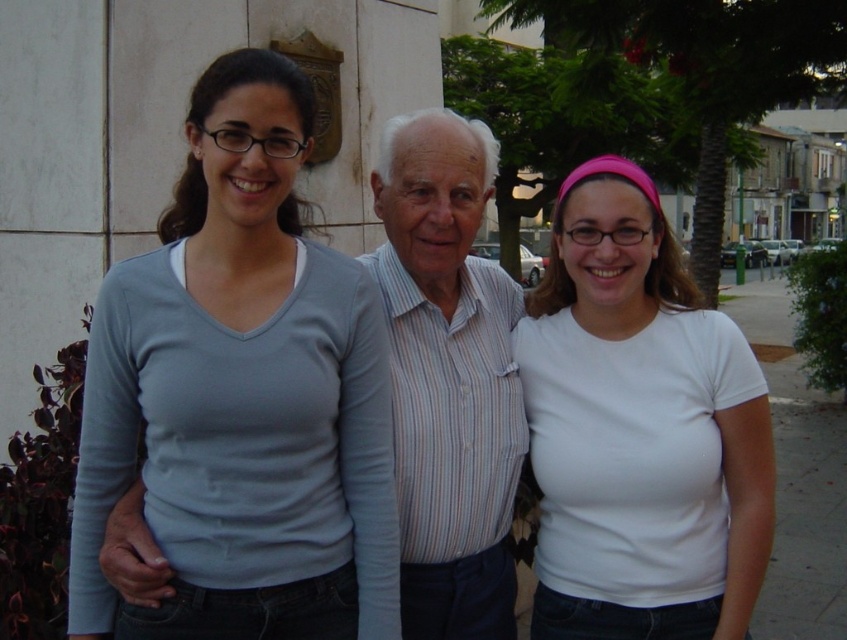
Who is positioned more to the left, white matte t-shirt at center or striped cotton shirt at center?

From the viewer's perspective, striped cotton shirt at center appears more on the left side.

From the picture: Between white matte t-shirt at center and striped cotton shirt at center, which one has more height?

white matte t-shirt at center is taller.

Locate an element on the screen. The width and height of the screenshot is (847, 640). white matte t-shirt at center is located at coordinates (639, 429).

Image resolution: width=847 pixels, height=640 pixels. What are the coordinates of `white matte t-shirt at center` in the screenshot? It's located at (639, 429).

Between point (673, 598) and point (389, 170), which one is positioned behind?

The point (389, 170) is behind.

Which of these two, white matte t-shirt at center or light blue fabric shirt at center, stands shorter?

white matte t-shirt at center

Between point (558, 628) and point (462, 209), which one is positioned in front?

Point (558, 628)

Image resolution: width=847 pixels, height=640 pixels. I want to click on white matte t-shirt at center, so click(639, 429).

Does light blue fabric shirt at center appear under striped cotton shirt at center?

Indeed, light blue fabric shirt at center is positioned under striped cotton shirt at center.

Is light blue fabric shirt at center wider than striped cotton shirt at center?

Yes, light blue fabric shirt at center is wider than striped cotton shirt at center.

What do you see at coordinates (433, 198) in the screenshot?
I see `light blue fabric shirt at center` at bounding box center [433, 198].

You are a GUI agent. You are given a task and a screenshot of the screen. Output one action in this format:
    pyautogui.click(x=<x>, y=<y>)
    Task: Click on the light blue fabric shirt at center
    This screenshot has height=640, width=847.
    Given the screenshot: What is the action you would take?
    pyautogui.click(x=433, y=198)